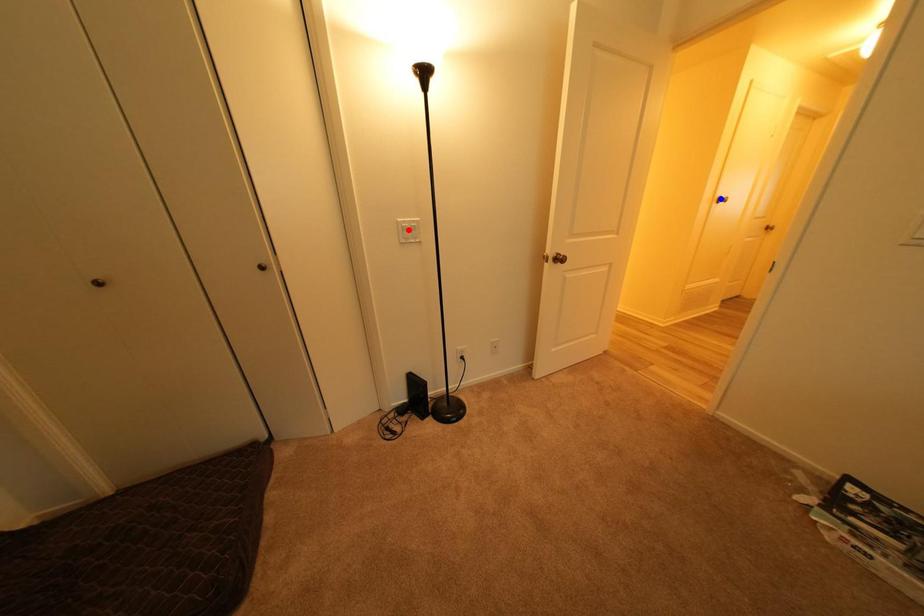
Question: Two points are marked on the image. Which point is closer to the camera?

Choices:
 (A) Blue point is closer.
 (B) Red point is closer.

Answer: (B)